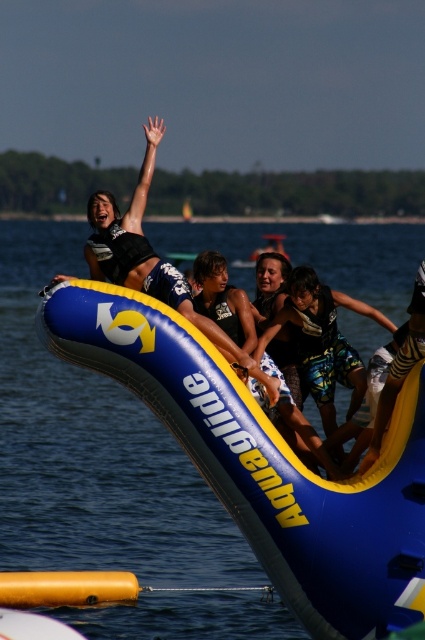
You are standing at the point with coordinates point (316, 291) and want to see the point with coordinates point (142, 394). Can you see it without moving your head?

Point (142, 394) is in front of point (316, 291), so yes, you can see it without moving your head.

You are standing at the edge of the water park lake and see the blue inflatable boat at center and the blue and white wetsuit at center. Which object is closer to the left side of the lake?

The blue inflatable boat at center is to the left of the blue and white wetsuit at center, so it is closer to the left side of the lake.

You are a lifeguard at the water park and need to rescue someone in the blue inflatable boat at center. You are currently wearing the blue and white wetsuit at center. Which direction should you swim to reach the boat?

The blue inflatable boat at center is below the blue and white wetsuit at center, so you should swim downward to reach the boat.